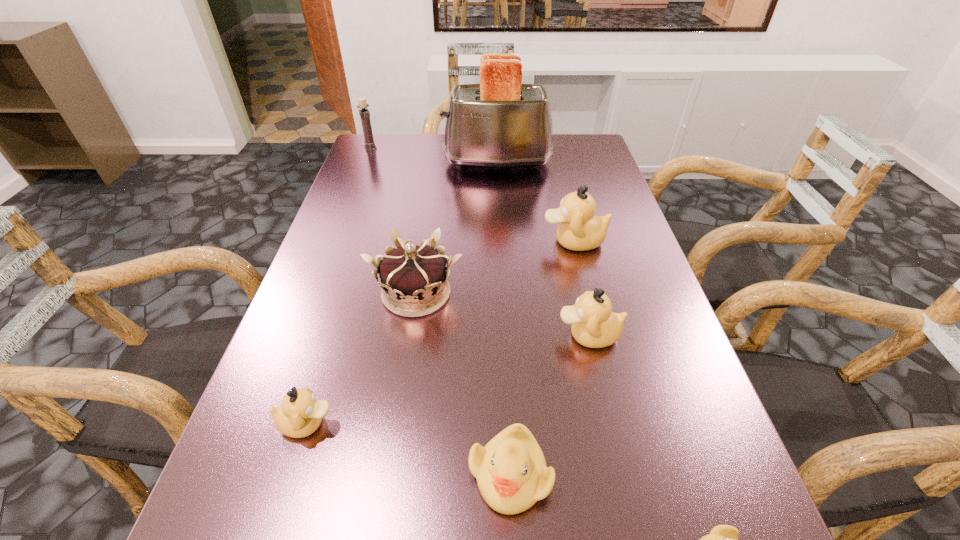
The height and width of the screenshot is (540, 960). Find the location of `gray toaster`. gray toaster is located at coordinates (500, 123).

Image resolution: width=960 pixels, height=540 pixels. Find the location of `the tallest object`. the tallest object is located at coordinates (500, 123).

In order to click on the leftmost object in this screenshot , I will do `click(364, 113)`.

Image resolution: width=960 pixels, height=540 pixels. Identify the location of the third farthest object. (579, 230).

Where is `the farthest tan duckling`? The image size is (960, 540). the farthest tan duckling is located at coordinates (579, 230).

The image size is (960, 540). Find the location of `crown`. crown is located at coordinates (413, 278).

I want to click on the fourth shortest duckling, so click(x=594, y=325).

In order to click on the second nearest tan duckling in this screenshot , I will do `click(594, 325)`.

You are a GUI agent. You are given a task and a screenshot of the screen. Output one action in this format:
    pyautogui.click(x=<x>, y=<y>)
    Task: Click on the leftmost duckling
    Image resolution: width=960 pixels, height=540 pixels.
    Given the screenshot: What is the action you would take?
    pyautogui.click(x=300, y=415)

Where is `the nearest tan duckling`? The width and height of the screenshot is (960, 540). the nearest tan duckling is located at coordinates (300, 415).